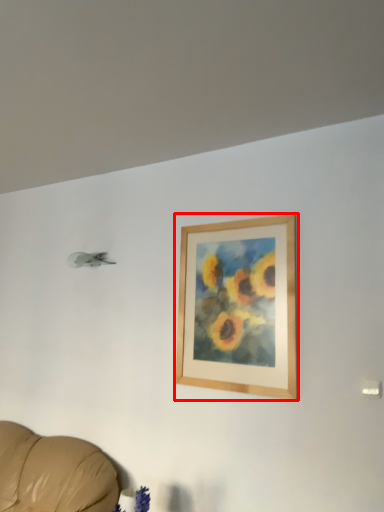
Question: Where is picture frame (annotated by the red box) located in relation to plant in the image?

Choices:
 (A) left
 (B) right

Answer: (B)